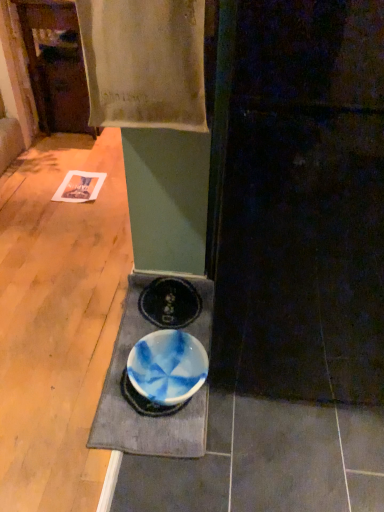
Question: Is white cotton towel at upper center aimed at blue glazed bowl at lower center?

Choices:
 (A) no
 (B) yes

Answer: (A)

Question: Does white cotton towel at upper center lie behind blue glazed bowl at lower center?

Choices:
 (A) yes
 (B) no

Answer: (B)

Question: From a real-world perspective, is white cotton towel at upper center on blue glazed bowl at lower center?

Choices:
 (A) yes
 (B) no

Answer: (A)

Question: Does white cotton towel at upper center have a greater width compared to blue glazed bowl at lower center?

Choices:
 (A) no
 (B) yes

Answer: (A)

Question: Is white cotton towel at upper center in contact with blue glazed bowl at lower center?

Choices:
 (A) no
 (B) yes

Answer: (A)

Question: Is blue glazed bowl at lower center surrounded by white cotton towel at upper center?

Choices:
 (A) yes
 (B) no

Answer: (B)

Question: Is blue glossy bowl at center in contact with blue glazed bowl at lower center?

Choices:
 (A) yes
 (B) no

Answer: (A)

Question: Can you confirm if blue glossy bowl at center is wider than blue glazed bowl at lower center?

Choices:
 (A) no
 (B) yes

Answer: (B)

Question: Can you confirm if blue glossy bowl at center is positioned to the right of blue glazed bowl at lower center?

Choices:
 (A) yes
 (B) no

Answer: (B)

Question: Is blue glossy bowl at center located outside blue glazed bowl at lower center?

Choices:
 (A) yes
 (B) no

Answer: (A)

Question: Considering the relative positions of blue glossy bowl at center and blue glazed bowl at lower center in the image provided, is blue glossy bowl at center to the left of blue glazed bowl at lower center from the viewer's perspective?

Choices:
 (A) no
 (B) yes

Answer: (B)

Question: Are blue glossy bowl at center and blue glazed bowl at lower center located far from each other?

Choices:
 (A) yes
 (B) no

Answer: (B)

Question: Can you confirm if blue glazed bowl at lower center is wider than white cotton towel at upper center?

Choices:
 (A) yes
 (B) no

Answer: (A)